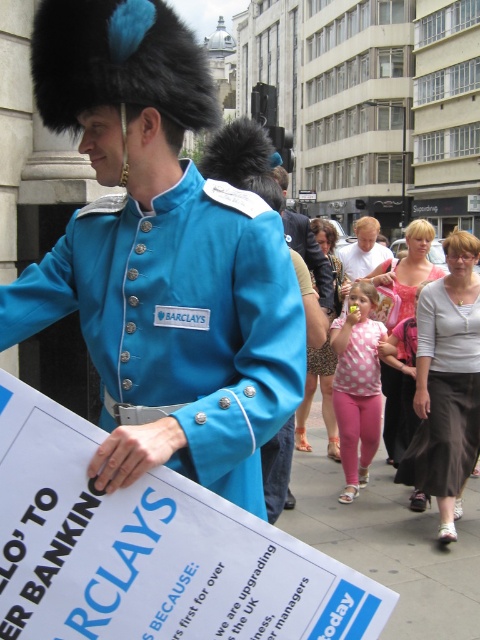
You are a photographer taking a picture of the scene. You notice the pink fabric at lower center and the pink polka dot leggings at center. Which object is positioned lower in the image?

The pink fabric at lower center is positioned lower than the pink polka dot leggings at center.

You are a photographer trying to capture both the matte blue fabric uniform at center and the pink fabric at lower center in the same frame. Which object should you focus on first to ensure both are in the frame?

The matte blue fabric uniform at center is smaller than the pink fabric at lower center. To capture both in the same frame, focus on the pink fabric at lower center first since it is larger and will be easier to position within the frame while ensuring the smaller uniform also fits.